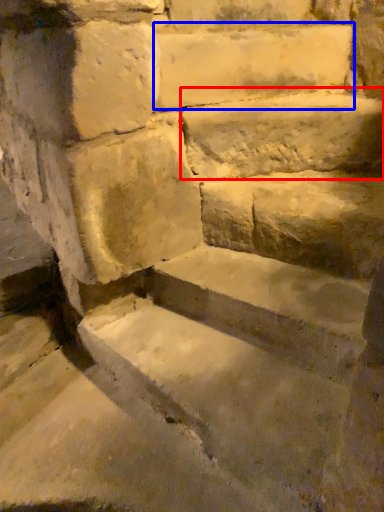
Question: Which object appears farthest to the camera in this image, limestone (highlighted by a red box) or limestone (highlighted by a blue box)?

Choices:
 (A) limestone
 (B) limestone

Answer: (B)